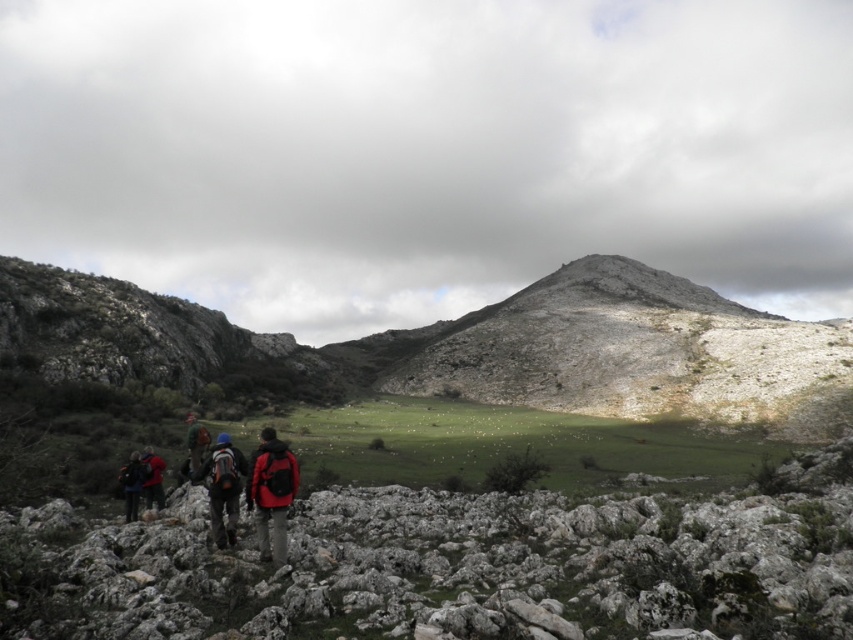
From the picture: Is matte black backpack at lower left further to camera compared to red jacket at center?

No, matte black backpack at lower left is in front of red jacket at center.

The height and width of the screenshot is (640, 853). I want to click on matte black backpack at lower left, so click(x=132, y=484).

Which is in front, point (129, 468) or point (199, 422)?

Point (129, 468) is in front.

Locate an element on the screen. Image resolution: width=853 pixels, height=640 pixels. matte black backpack at lower left is located at coordinates (132, 484).

Does rugged stone mountain at center have a larger size compared to red jacket at center?

Correct, rugged stone mountain at center is larger in size than red jacket at center.

Is rugged stone mountain at center thinner than red jacket at center?

No, rugged stone mountain at center is not thinner than red jacket at center.

Which is in front, point (723, 365) or point (189, 442)?

Point (189, 442) is more forward.

Identify the location of rugged stone mountain at center. (473, 346).

Is rugged stone mountain at center wider than red matte jacket at lower left?

Yes, rugged stone mountain at center is wider than red matte jacket at lower left.

Is rugged stone mountain at center taller than red matte jacket at lower left?

Yes, rugged stone mountain at center is taller than red matte jacket at lower left.

Which is in front, point (451, 376) or point (152, 488)?

Point (152, 488)

Identify the location of rugged stone mountain at center. Image resolution: width=853 pixels, height=640 pixels. (473, 346).